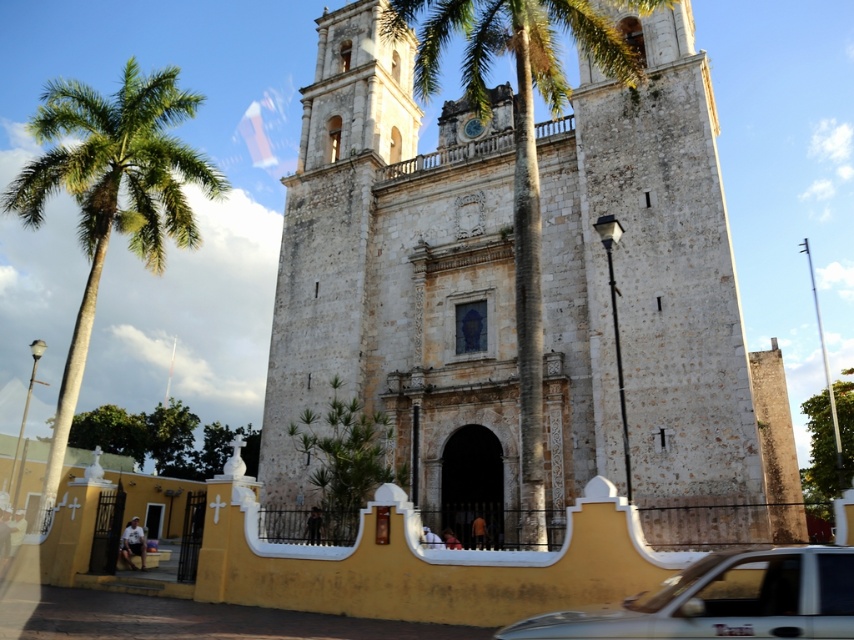
You are standing in front of the historic stone church and want to determine the relative positions of two points marked on the scene. Which point is closer to you, point (x=56, y=170) or point (x=583, y=3)?

Point (x=56, y=170) is further to the viewer than point (x=583, y=3). Wait, the answer seems contradictory. Let me check the description again. The Objects Description says that point (x=56, y=170) is further to the viewer than point (x=583, y=3). So the closer one would be point (x=583, y=3). Hmm, but the question asks which is closer to you. Since the first point is further away, the second point must be closer. Therefore, the answer should state that point (x=583, y=3) is closer. But the description says 0